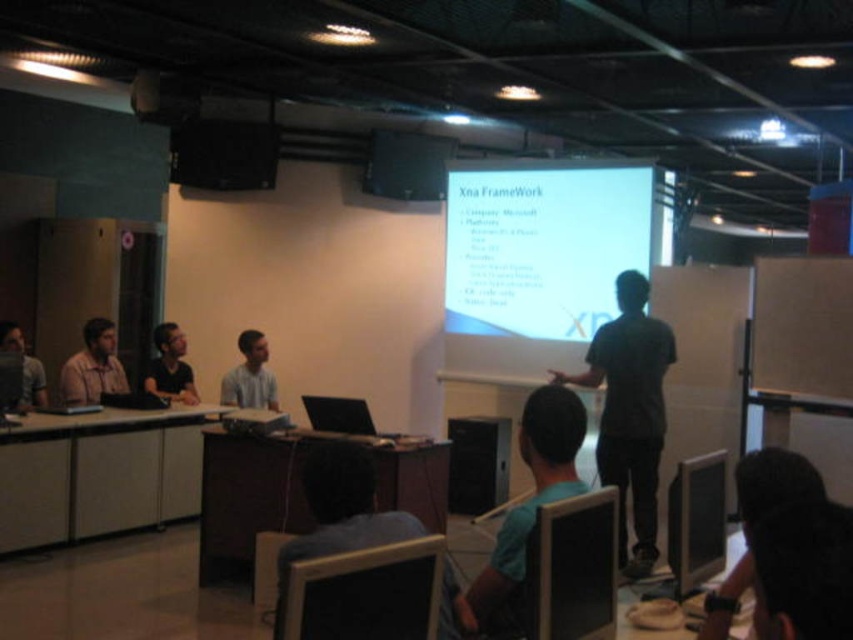
Which is in front, point (624, 451) or point (305, 483)?

Positioned in front is point (305, 483).

Based on the photo, who is higher up, dark gray shirt at center or blue fabric shirt at center?

Positioned higher is dark gray shirt at center.

Is point (641, 372) closer to camera compared to point (450, 625)?

No.

Find the location of a particular element. dark gray shirt at center is located at coordinates (630, 412).

Between white matte projection screen at upper center and matte brown shirt at left, which one has less height?

Standing shorter between the two is matte brown shirt at left.

Does white matte projection screen at upper center come behind matte brown shirt at left?

Yes, it is.

This screenshot has height=640, width=853. What do you see at coordinates (543, 248) in the screenshot? I see `white matte projection screen at upper center` at bounding box center [543, 248].

I want to click on white matte projection screen at upper center, so click(543, 248).

Is white matte projection screen at upper center to the right of blue fabric shirt at center from the viewer's perspective?

Yes, white matte projection screen at upper center is to the right of blue fabric shirt at center.

The image size is (853, 640). What are the coordinates of `white matte projection screen at upper center` in the screenshot? It's located at (543, 248).

Is point (454, 211) positioned after point (318, 509)?

Yes, it is behind point (318, 509).

At what (x,y) coordinates should I click in order to perform the action: click on white matte projection screen at upper center. Please return your answer as a coordinate pair (x, y). This screenshot has height=640, width=853. Looking at the image, I should click on (543, 248).